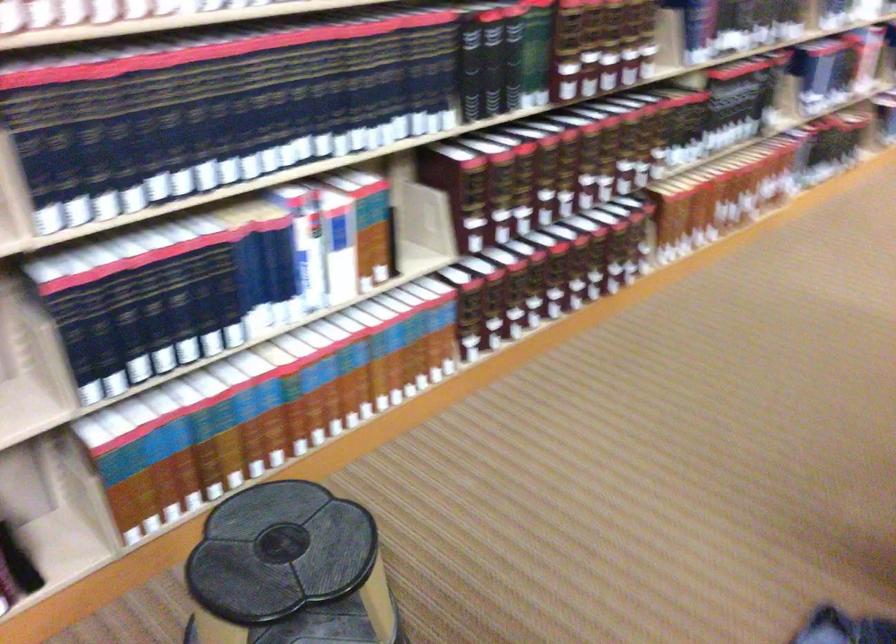
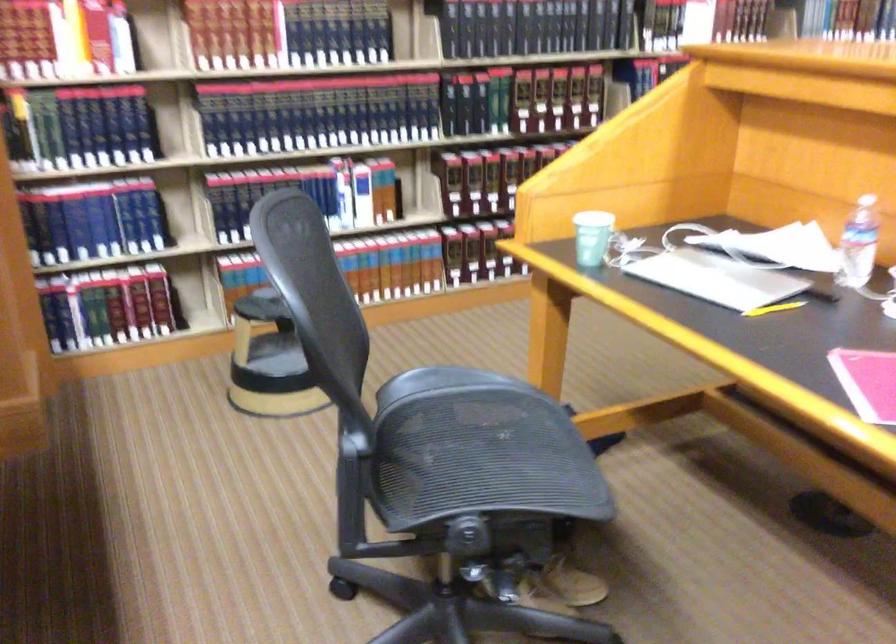
Which direction would the cameraman need to move to produce the second image?

The movement direction of the cameraman is right, backward.